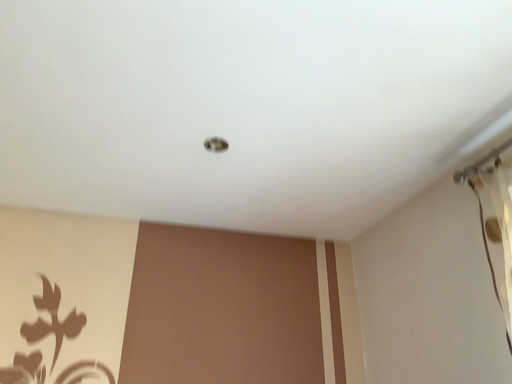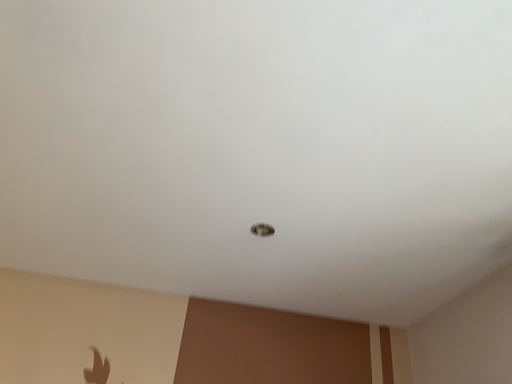
Question: Which way did the camera rotate in the video?

Choices:
 (A) rotated left
 (B) rotated right

Answer: (A)